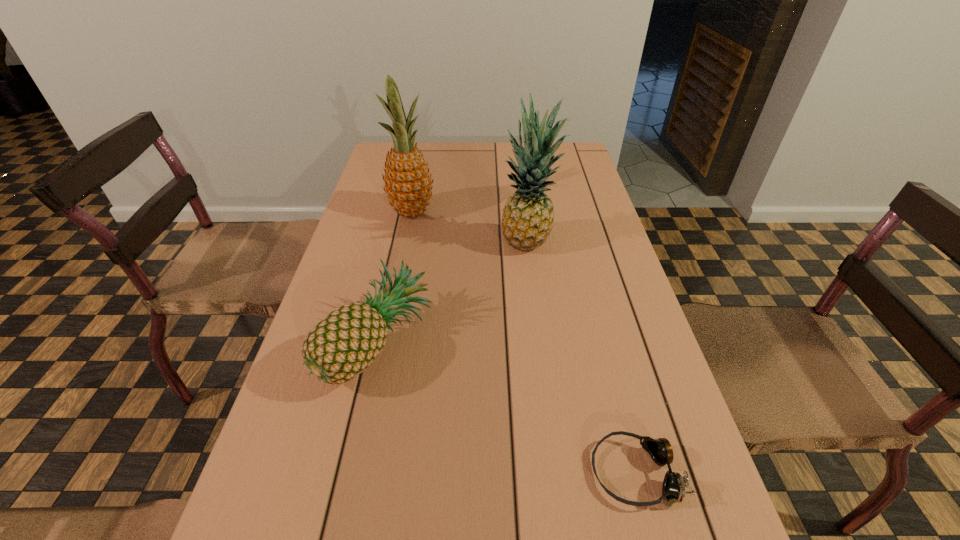
The image size is (960, 540). In order to click on free point located through the lenses of the shortest object in this screenshot , I will do `click(444, 472)`.

Where is `vacant area situated through the lenses of the shortest object`? The image size is (960, 540). vacant area situated through the lenses of the shortest object is located at coordinates coord(402,472).

Locate an element on the screen. free spot located 0.150m through the lenses of the shortest object is located at coordinates (503, 472).

Locate an element on the screen. object situated at the right edge is located at coordinates (673, 489).

Find the location of `vacant region at the far edge of the desktop`. vacant region at the far edge of the desktop is located at coordinates (444, 151).

This screenshot has height=540, width=960. In the image, there is a desktop. In order to click on free space at the left edge in this screenshot , I will do `click(330, 293)`.

The image size is (960, 540). I want to click on free space at the right edge of the desktop, so click(560, 196).

Where is `free space at the far right corner`? free space at the far right corner is located at coordinates (564, 160).

Locate an element on the screen. The width and height of the screenshot is (960, 540). free space between the nearest object and the farthest pineapple is located at coordinates (523, 342).

Locate an element on the screen. The width and height of the screenshot is (960, 540). vacant area that lies between the goggles and the rightmost pineapple is located at coordinates (581, 359).